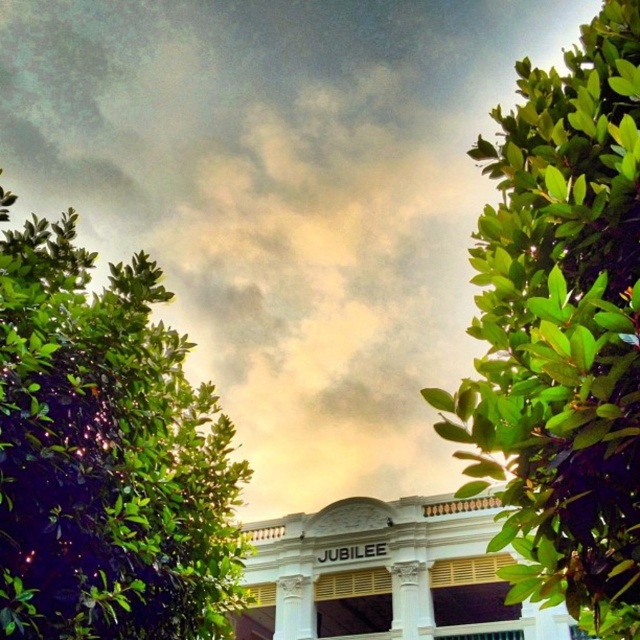
You are a landscape designer planning to install a walkway between the green glossy leaves at right and the green leafy tree at left. The walkway must be at least 20 meters long to accommodate all the planned features. Based on the scene, will the available space between them be sufficient?

The distance between the green glossy leaves at right and the green leafy tree at left is 19.76 meters. Since the required length is 20 meters, the available space is slightly insufficient by 0.24 meters.

You are standing in a garden and want to take a photo of the green glossy leaves at right with your camera. The camera has a minimum focusing distance of 1.5 meters. Can you take a clear photo without moving closer?

The green glossy leaves at right and camera are 20.59 meters apart from each other, so yes, you can take a clear photo without moving closer since the distance is well beyond the camera minimum focusing distance of 1.5 meters.